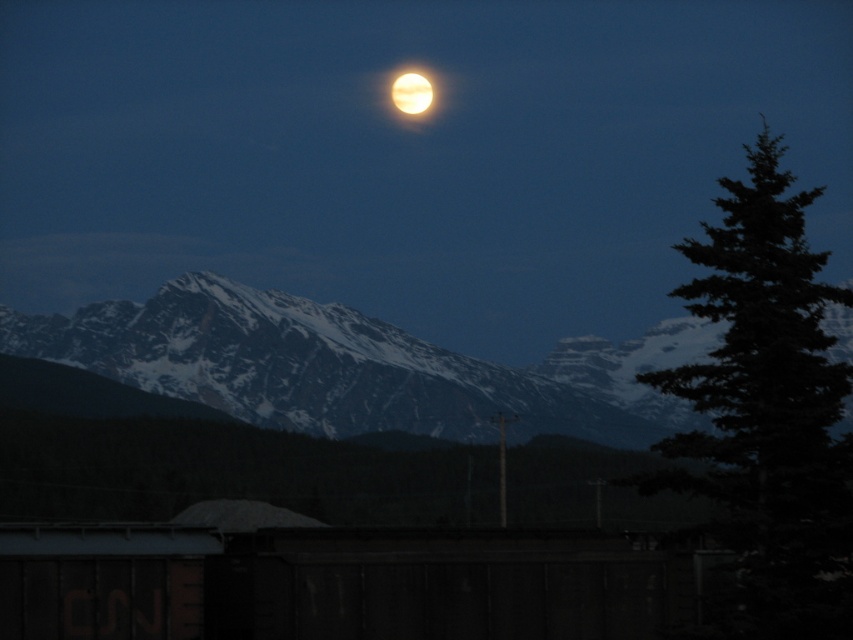
Question: Which point is farther to the camera?

Choices:
 (A) bright yellow moon at upper center
 (B) green textured tree at right

Answer: (A)

Question: Can you confirm if bright yellowish-white moon at upper center is positioned to the left of bright yellow moon at upper center?

Choices:
 (A) yes
 (B) no

Answer: (B)

Question: Estimate the real-world distances between objects in this image. Which object is closer to the green textured tree at right?

Choices:
 (A) snowy rock mountain range at center
 (B) bright yellow moon at upper center
 (C) bright yellowish-white moon at upper center

Answer: (A)

Question: Does green textured tree at right have a greater width compared to bright yellowish-white moon at upper center?

Choices:
 (A) yes
 (B) no

Answer: (A)

Question: Which point is closer to the camera taking this photo?

Choices:
 (A) (427, 90)
 (B) (776, 195)

Answer: (B)

Question: Is bright yellowish-white moon at upper center in front of bright yellow moon at upper center?

Choices:
 (A) yes
 (B) no

Answer: (B)